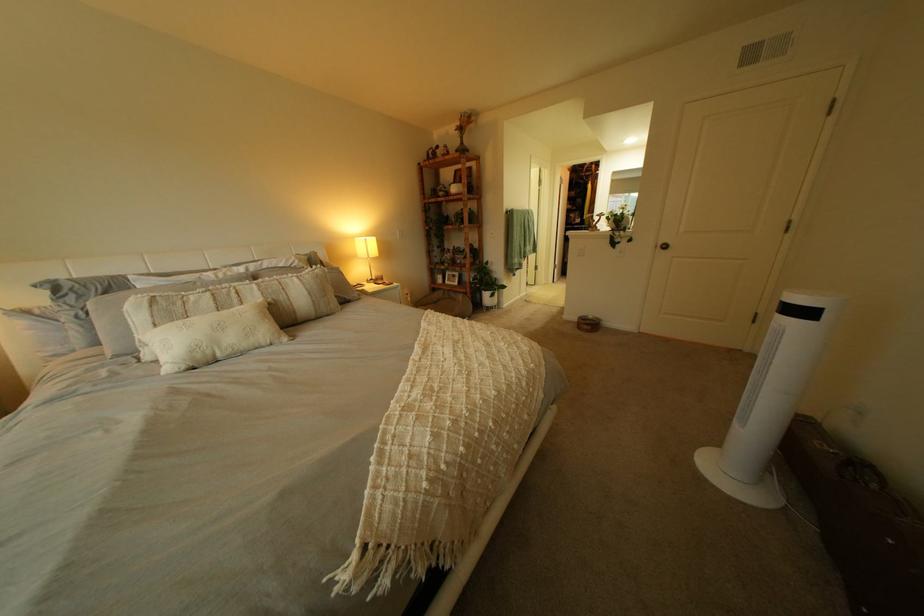
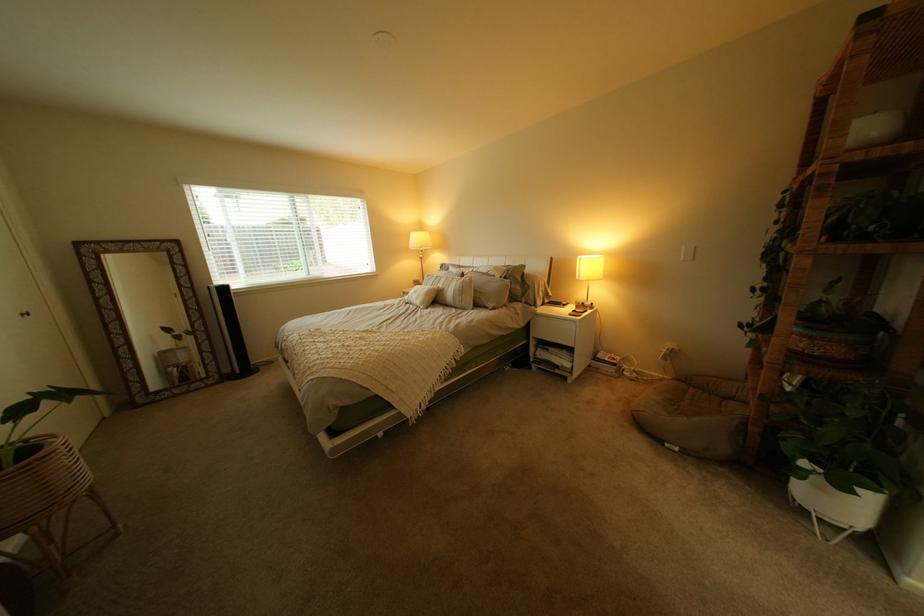
The point at (375, 300) is marked in the first image. Where is the corresponding point in the second image?

(509, 310)